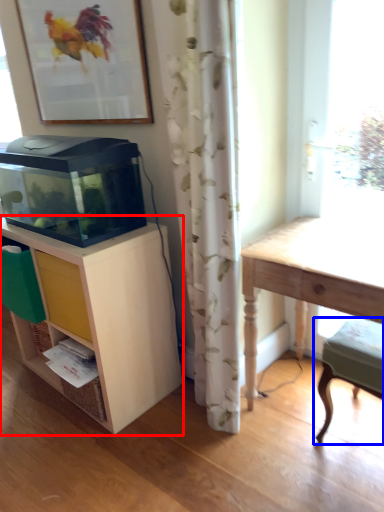
Question: Which object appears farthest to the camera in this image, shelf (highlighted by a red box) or step stool (highlighted by a blue box)?

Choices:
 (A) shelf
 (B) step stool

Answer: (A)